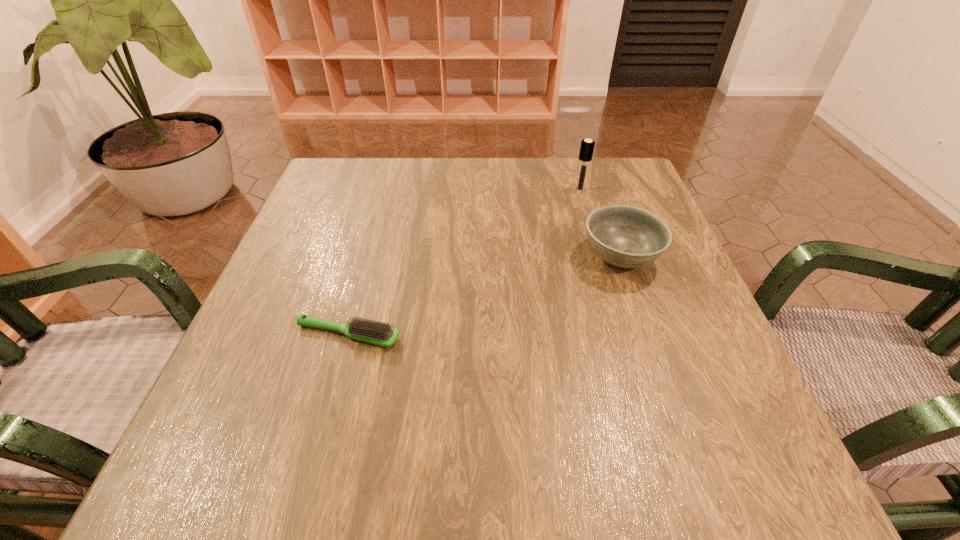
Find the location of a particular element. the farther hairbrush is located at coordinates (587, 146).

This screenshot has width=960, height=540. In order to click on the right hairbrush in this screenshot , I will do `click(587, 146)`.

What are the coordinates of `the second nearest object` in the screenshot? It's located at (624, 236).

The width and height of the screenshot is (960, 540). Identify the location of the second tallest object. (624, 236).

Identify the location of the nearest object. (376, 332).

Where is `the leftmost object`? The height and width of the screenshot is (540, 960). the leftmost object is located at coordinates (376, 332).

Identify the location of blank space located 0.120m on the left of the farthest object. (524, 188).

Locate an element on the screen. This screenshot has height=540, width=960. vacant space located 0.250m on the back of the second nearest object is located at coordinates (590, 172).

Identify the location of vacant area located 0.160m on the right of the left hairbrush. Image resolution: width=960 pixels, height=540 pixels. (493, 334).

At what (x,y) coordinates should I click in order to perform the action: click on object that is at the far edge. Please return your answer as a coordinate pair (x, y). Looking at the image, I should click on (587, 146).